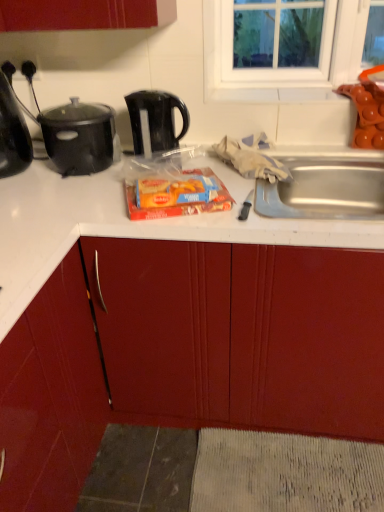
Question: Should I look upward or downward to see black matte pot at upper left?

Choices:
 (A) down
 (B) up

Answer: (B)

Question: Is matte plastic snack pack at center far from shiny black kettle at left?

Choices:
 (A) no
 (B) yes

Answer: (A)

Question: Can you confirm if matte plastic snack pack at center is taller than shiny black kettle at left?

Choices:
 (A) no
 (B) yes

Answer: (A)

Question: Is matte plastic snack pack at center aimed at shiny black kettle at left?

Choices:
 (A) no
 (B) yes

Answer: (A)

Question: From the image's perspective, does matte plastic snack pack at center appear lower than shiny black kettle at left?

Choices:
 (A) no
 (B) yes

Answer: (B)

Question: Is matte plastic snack pack at center located outside shiny black kettle at left?

Choices:
 (A) no
 (B) yes

Answer: (B)

Question: Is matte plastic snack pack at center positioned in front of shiny black kettle at left?

Choices:
 (A) no
 (B) yes

Answer: (B)

Question: Is matte red cabinet at center to the right of matte plastic snack pack at center from the viewer's perspective?

Choices:
 (A) no
 (B) yes

Answer: (A)

Question: From the image's perspective, would you say matte red cabinet at center is shown under matte plastic snack pack at center?

Choices:
 (A) yes
 (B) no

Answer: (A)

Question: Does matte red cabinet at center have a greater width compared to matte plastic snack pack at center?

Choices:
 (A) no
 (B) yes

Answer: (B)

Question: Does matte red cabinet at center have a larger size compared to matte plastic snack pack at center?

Choices:
 (A) yes
 (B) no

Answer: (A)

Question: Is the depth of matte red cabinet at center greater than that of matte plastic snack pack at center?

Choices:
 (A) no
 (B) yes

Answer: (A)

Question: Is matte red cabinet at center touching matte plastic snack pack at center?

Choices:
 (A) no
 (B) yes

Answer: (A)

Question: Can you confirm if black matte pot at upper left is wider than matte red cabinet at center?

Choices:
 (A) no
 (B) yes

Answer: (A)